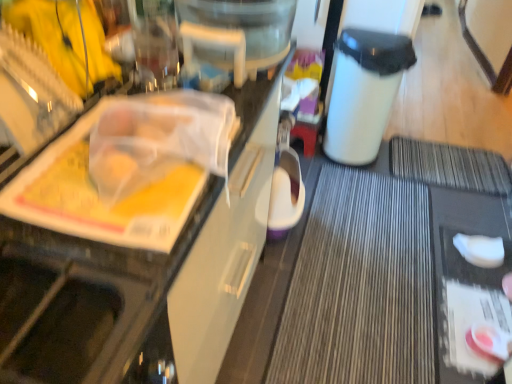
Where is `vacant region in front of white matte sponge at lower right, which appears as the first food when viewed from the back`? This screenshot has width=512, height=384. vacant region in front of white matte sponge at lower right, which appears as the first food when viewed from the back is located at coordinates (477, 288).